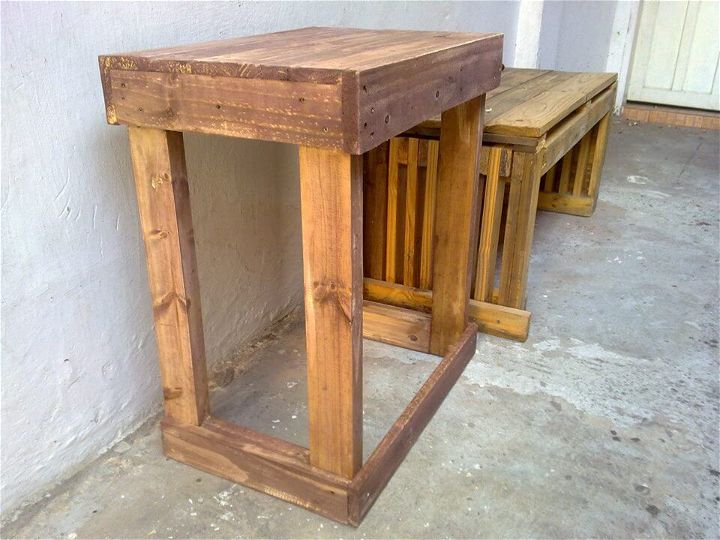
At what (x,y) coordinates should I click in order to perform the action: click on shorter wooden table top. Please return your answer as a coordinate pair (x, y). The image size is (720, 540). Looking at the image, I should click on (526, 126).